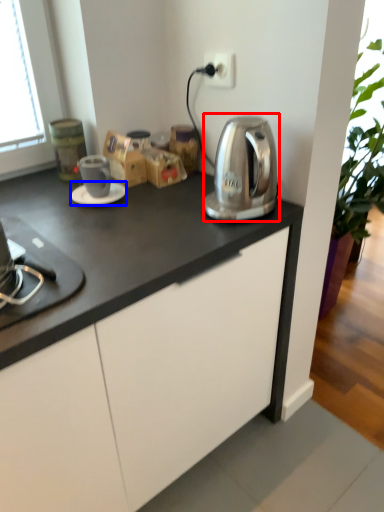
Question: Which point is closer to the camera, kitchen appliance (highlighted by a red box) or saucer (highlighted by a blue box)?

Choices:
 (A) kitchen appliance
 (B) saucer

Answer: (A)